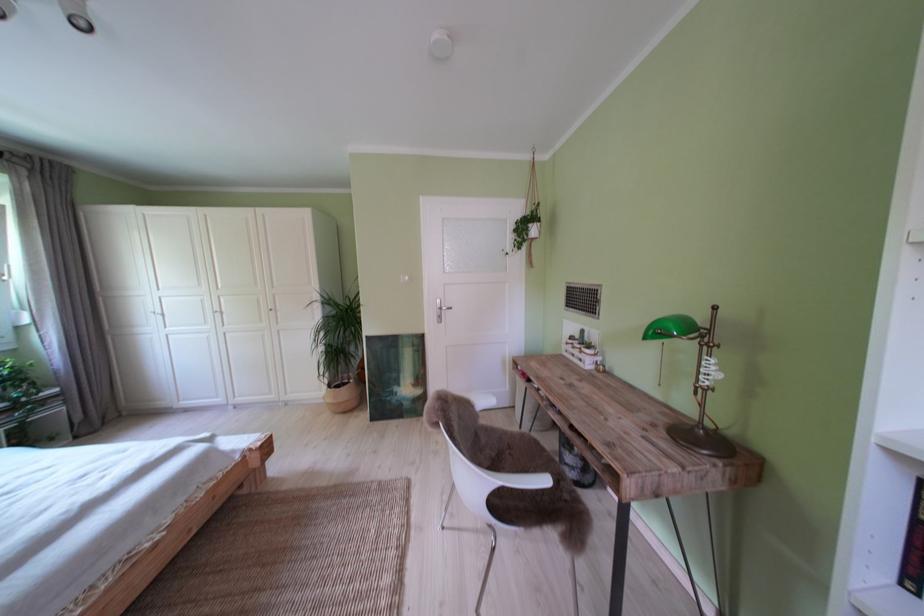
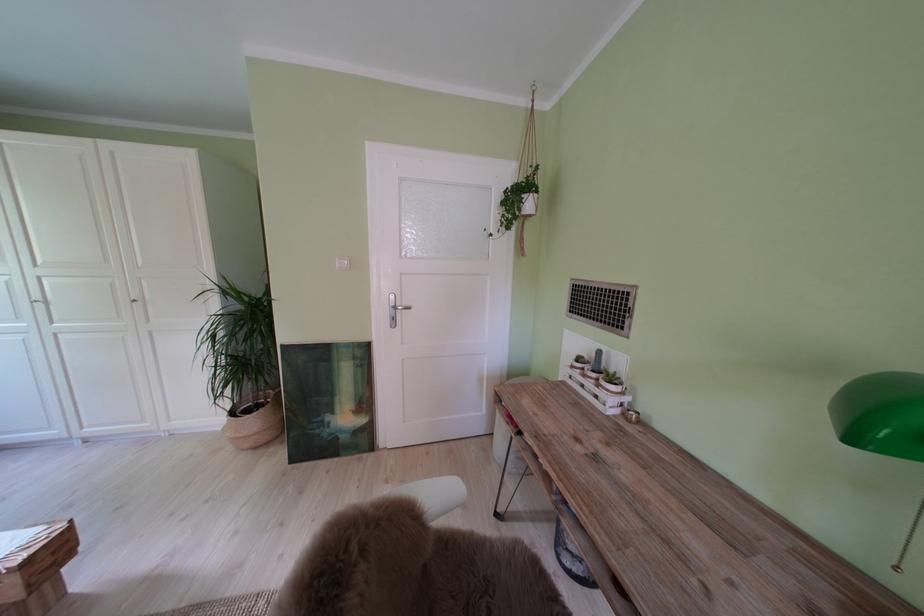
Find the pixel in the second image that matches point 538,241 in the first image.

(530, 215)